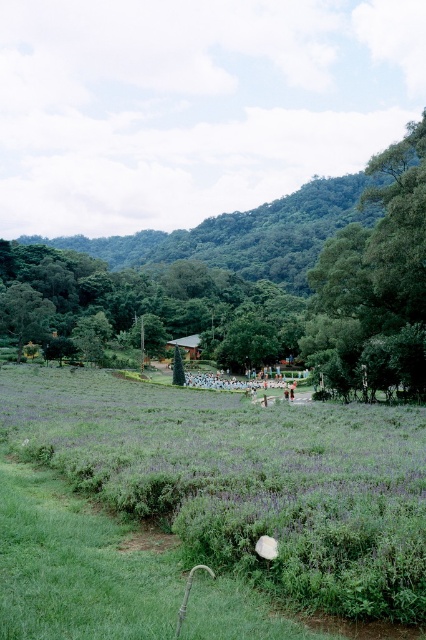
Does green grass at center have a lesser width compared to green leafy tree at center?

Indeed, green grass at center has a lesser width compared to green leafy tree at center.

In the scene shown: Can you confirm if green grass at center is shorter than green leafy tree at center?

Indeed, green grass at center has a lesser height compared to green leafy tree at center.

What do you see at coordinates (244, 481) in the screenshot? The image size is (426, 640). I see `green grass at center` at bounding box center [244, 481].

I want to click on green grass at center, so click(x=244, y=481).

Does green grass at center have a greater height compared to green leafy tree at upper right?

No.

Does green grass at center appear over green leafy tree at upper right?

Actually, green grass at center is below green leafy tree at upper right.

Which is in front, point (362, 410) or point (420, 134)?

Point (362, 410) is in front.

Find the location of a particular element. green grass at center is located at coordinates (244, 481).

Which of these two, green leafy tree at center or green leafy tree at upper right, stands taller?

With more height is green leafy tree at center.

Which is behind, point (333, 364) or point (399, 362)?

Positioned behind is point (333, 364).

This screenshot has width=426, height=640. Find the location of `green leafy tree at center`. green leafy tree at center is located at coordinates (264, 278).